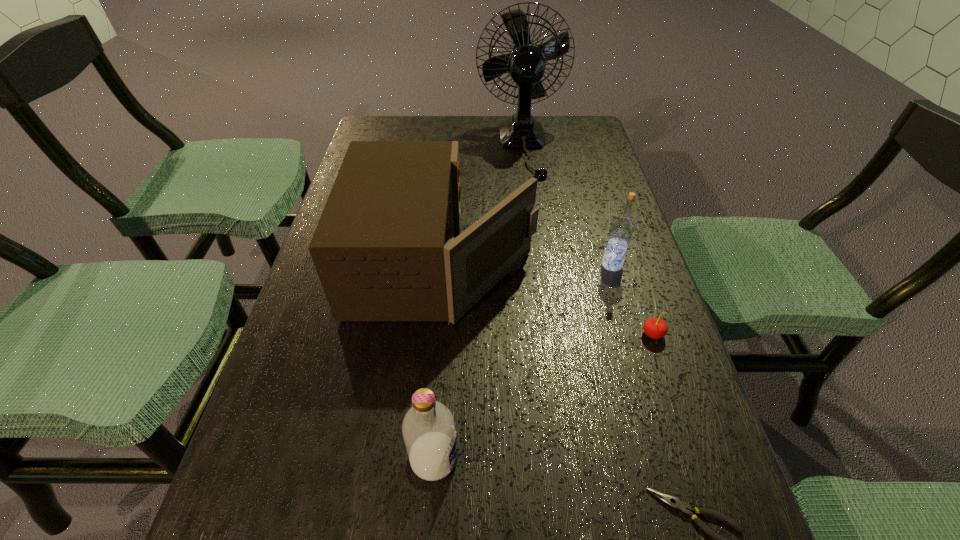
Identify the location of object that stands as the closest to the left vodka. The image size is (960, 540). (384, 249).

The height and width of the screenshot is (540, 960). Identify the location of vacant space that satisfies the following two spatial constraints: 1. in front of the second shortest object, indicating the direction of air flow; 2. on the left side of the tallest object. (548, 334).

This screenshot has height=540, width=960. Identify the location of free space that satisfies the following two spatial constraints: 1. in front of the right vodka, indicating the direction of air flow; 2. on the left side of the fan. (539, 265).

Locate an element on the screen. vacant space that satisfies the following two spatial constraints: 1. with the door open on the front of the microwave oven; 2. on the left side of the fifth tallest object is located at coordinates (438, 334).

Where is `vacant region that satisfies the following two spatial constraints: 1. in front of the farthest object, indicating the direction of air flow; 2. with the door open on the front of the microwave oven`? vacant region that satisfies the following two spatial constraints: 1. in front of the farthest object, indicating the direction of air flow; 2. with the door open on the front of the microwave oven is located at coordinates (539, 263).

You are a GUI agent. You are given a task and a screenshot of the screen. Output one action in this format:
    pyautogui.click(x=<x>, y=<y>)
    Task: Click on the free location that satisfies the following two spatial constraints: 1. on the front side of the right vodka; 2. on the left side of the second shortest object
    
    Given the screenshot: What is the action you would take?
    pyautogui.click(x=633, y=334)